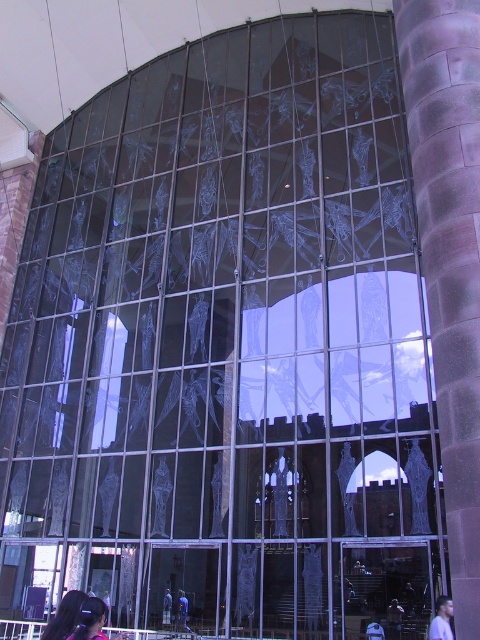
Is purple stone pillar at right to the left of dark blue fabric at lower center from the viewer's perspective?

Indeed, purple stone pillar at right is positioned on the left side of dark blue fabric at lower center.

Does purple stone pillar at right have a greater height compared to dark blue fabric at lower center?

Yes.

The width and height of the screenshot is (480, 640). What do you see at coordinates (450, 253) in the screenshot?
I see `purple stone pillar at right` at bounding box center [450, 253].

Locate an element on the screen. Image resolution: width=480 pixels, height=640 pixels. purple stone pillar at right is located at coordinates (450, 253).

The width and height of the screenshot is (480, 640). What do you see at coordinates (64, 616) in the screenshot?
I see `smooth black hair at lower left` at bounding box center [64, 616].

Is smooth black hair at lower left to the left of blue denim jeans at center from the viewer's perspective?

Correct, you'll find smooth black hair at lower left to the left of blue denim jeans at center.

The height and width of the screenshot is (640, 480). In order to click on smooth black hair at lower left in this screenshot , I will do `click(64, 616)`.

Is purple stone pillar at right thinner than smooth black hair at lower left?

No.

The height and width of the screenshot is (640, 480). Describe the element at coordinates (450, 253) in the screenshot. I see `purple stone pillar at right` at that location.

At what (x,y) coordinates should I click in order to perform the action: click on purple stone pillar at right. Please return your answer as a coordinate pair (x, y). The width and height of the screenshot is (480, 640). Looking at the image, I should click on (450, 253).